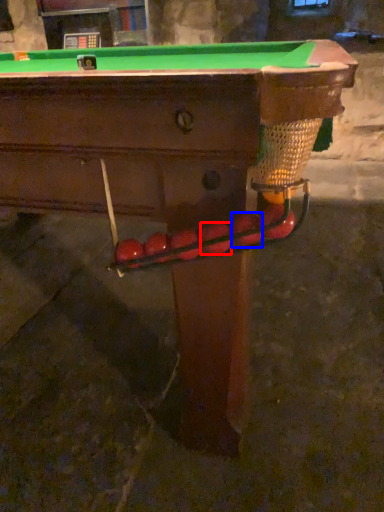
Question: Which of the following is the farthest to the observer, fruit (highlighted by a red box) or fruit (highlighted by a blue box)?

Choices:
 (A) fruit
 (B) fruit

Answer: (A)